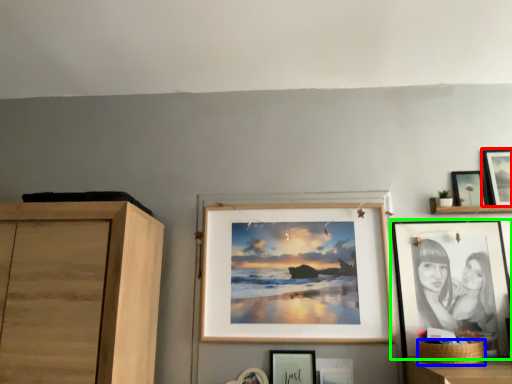
Question: Which object is positioned farthest from picture frame (highlighted by a red box)? Select from basket (highlighted by a blue box) and picture frame (highlighted by a green box).

Choices:
 (A) basket
 (B) picture frame

Answer: (A)